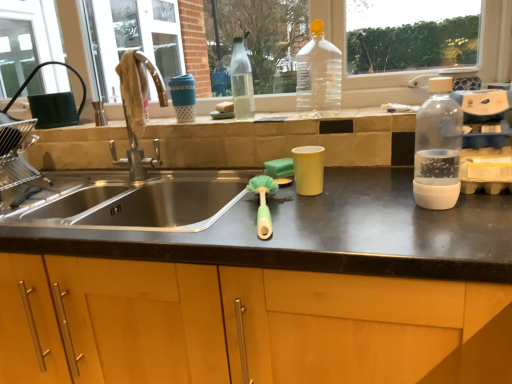
At what (x,y) coordinates should I click in order to perform the action: click on free region on the left part of transparent plastic bottle at center, positioned as the third bottle in right-to-left order. Please return your answer as a coordinate pair (x, y). The image size is (512, 384). Looking at the image, I should click on point(202,120).